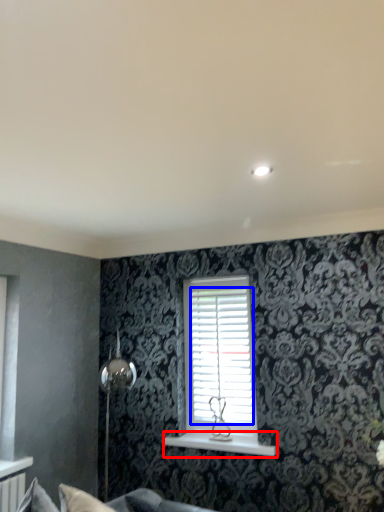
Question: Which point is closer to the camera, window sill (highlighted by a red box) or shutter (highlighted by a blue box)?

Choices:
 (A) window sill
 (B) shutter

Answer: (A)